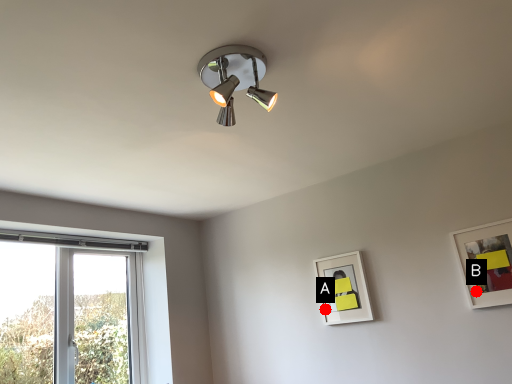
Question: Two points are circled on the image, labeled by A and B beside each circle. Among these points, which one is nearest to the camera?

Choices:
 (A) A is closer
 (B) B is closer

Answer: (B)